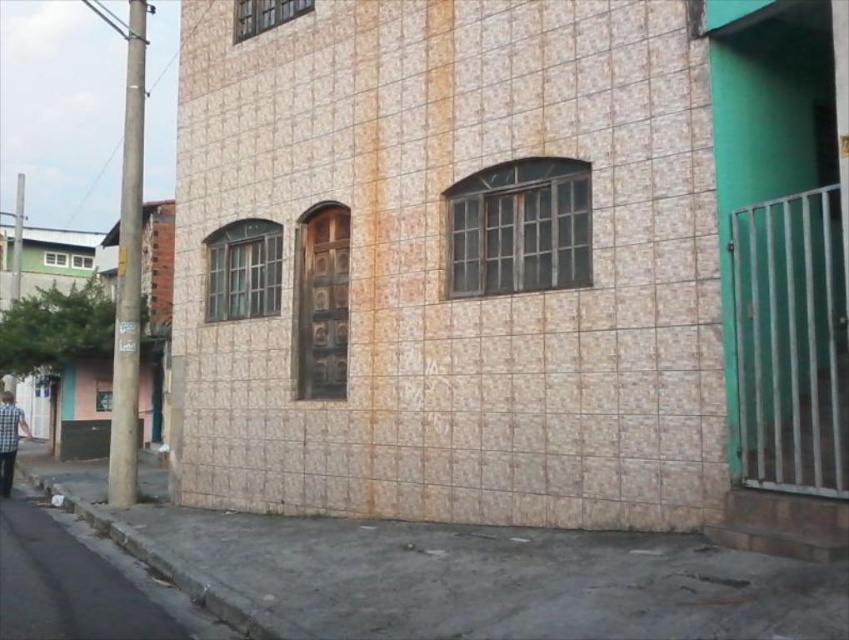
Does point (460, 268) lie behind point (256, 253)?

No, (460, 268) is closer to viewer.

Can you confirm if rusty metal window at center is positioned to the right of matte glass window at center left?

Indeed, rusty metal window at center is positioned on the right side of matte glass window at center left.

The height and width of the screenshot is (640, 849). I want to click on rusty metal window at center, so click(519, 227).

Locate an element on the screen. rusty metal window at center is located at coordinates [x=519, y=227].

Does point (239, 26) come behind point (85, 262)?

No, (239, 26) is in front of (85, 262).

Is clear glass window at upper center thinner than matte glass window at center?

No.

What are the coordinates of `clear glass window at upper center` in the screenshot? It's located at (265, 13).

Identify the location of clear glass window at upper center. The height and width of the screenshot is (640, 849). (265, 13).

Is matte glass window at center left below clear glass window at upper center?

Indeed, matte glass window at center left is positioned under clear glass window at upper center.

Does point (270, 266) lie in front of point (242, 12)?

Yes, point (270, 266) is closer to viewer.

What do you see at coordinates (243, 269) in the screenshot?
I see `matte glass window at center left` at bounding box center [243, 269].

Where is `matte glass window at center left`? This screenshot has height=640, width=849. matte glass window at center left is located at coordinates (243, 269).